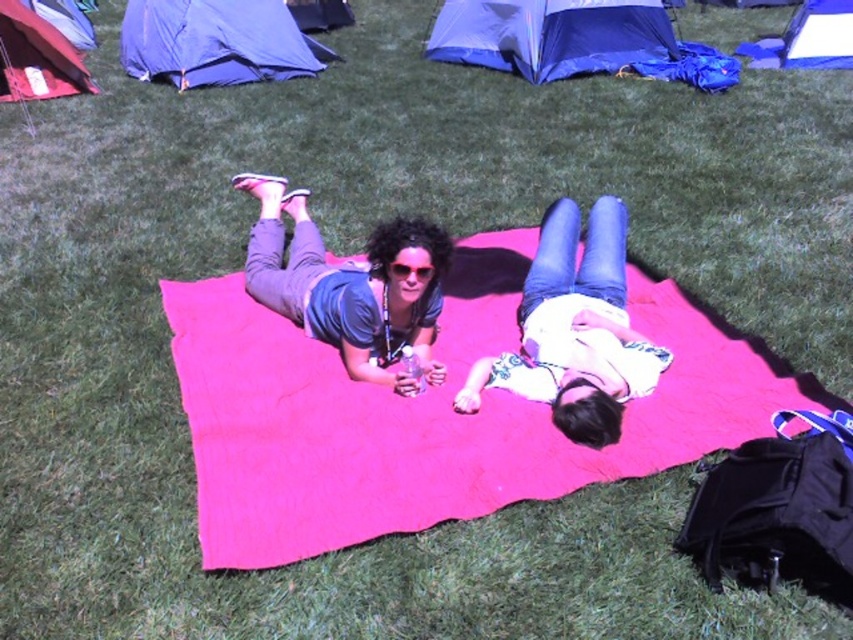
Does point (273, 456) lie behind point (467, 376)?

No, (273, 456) is closer to viewer.

In the scene shown: Can you confirm if pink fabric blanket at center is positioned to the right of white matte shirt at center?

In fact, pink fabric blanket at center is to the left of white matte shirt at center.

Which is behind, point (325, 476) or point (610, 397)?

Point (610, 397)

Locate an element on the screen. The height and width of the screenshot is (640, 853). pink fabric blanket at center is located at coordinates (432, 413).

Describe the element at coordinates (575, 330) in the screenshot. The width and height of the screenshot is (853, 640). I see `white matte shirt at center` at that location.

Who is positioned more to the right, white matte shirt at center or blue fabric tent at upper left?

A: white matte shirt at center

Is point (630, 387) closer to viewer compared to point (221, 19)?

That is True.

Find the location of a particular element. The width and height of the screenshot is (853, 640). white matte shirt at center is located at coordinates (575, 330).

Is blue fabric tent at upper left positioned in front of matte blue tent at upper left?

No, it is not.

You are a GUI agent. You are given a task and a screenshot of the screen. Output one action in this format:
    pyautogui.click(x=<x>, y=<y>)
    Task: Click on the blue fabric tent at upper left
    
    Given the screenshot: What is the action you would take?
    pyautogui.click(x=216, y=42)

Which is behind, point (245, 54) or point (96, 92)?

The point (245, 54) is more distant.

Identify the location of blue fabric tent at upper left. (216, 42).